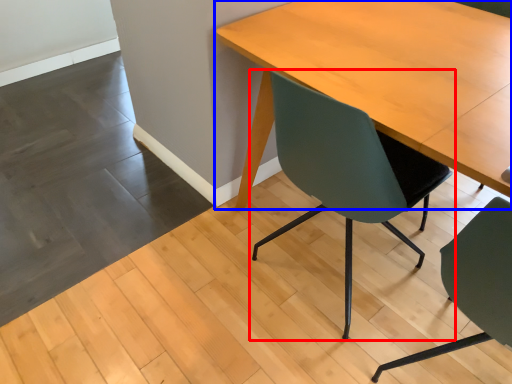
Question: Which object is closer to the camera taking this photo, chair (highlighted by a red box) or table (highlighted by a blue box)?

Choices:
 (A) chair
 (B) table

Answer: (B)